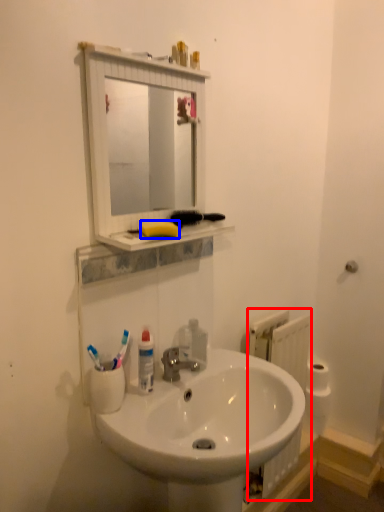
Question: Which object is further to the camera taking this photo, radiator (highlighted by a red box) or soap (highlighted by a blue box)?

Choices:
 (A) radiator
 (B) soap

Answer: (A)